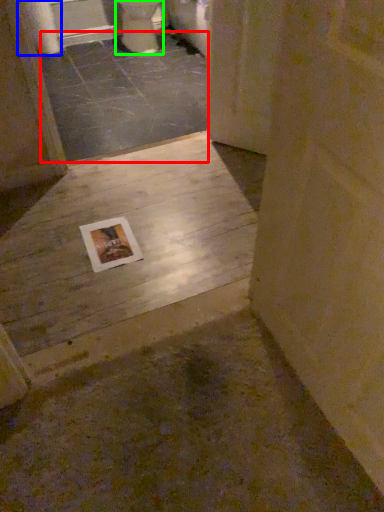
Question: Based on their relative distances, which object is farther from concrete (highlighted by a red box)? Choose from toilet paper (highlighted by a blue box) and toilet (highlighted by a green box).

Choices:
 (A) toilet paper
 (B) toilet

Answer: (A)